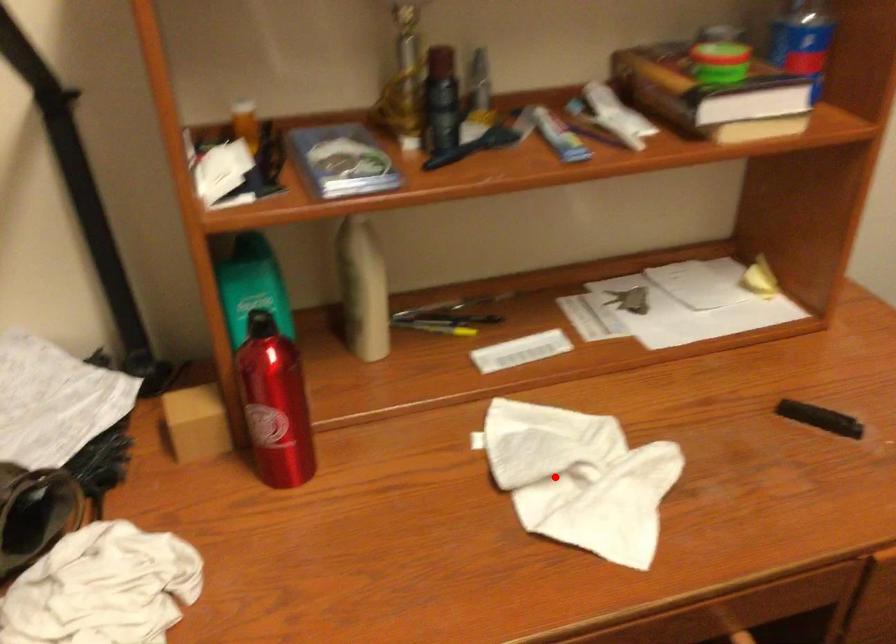
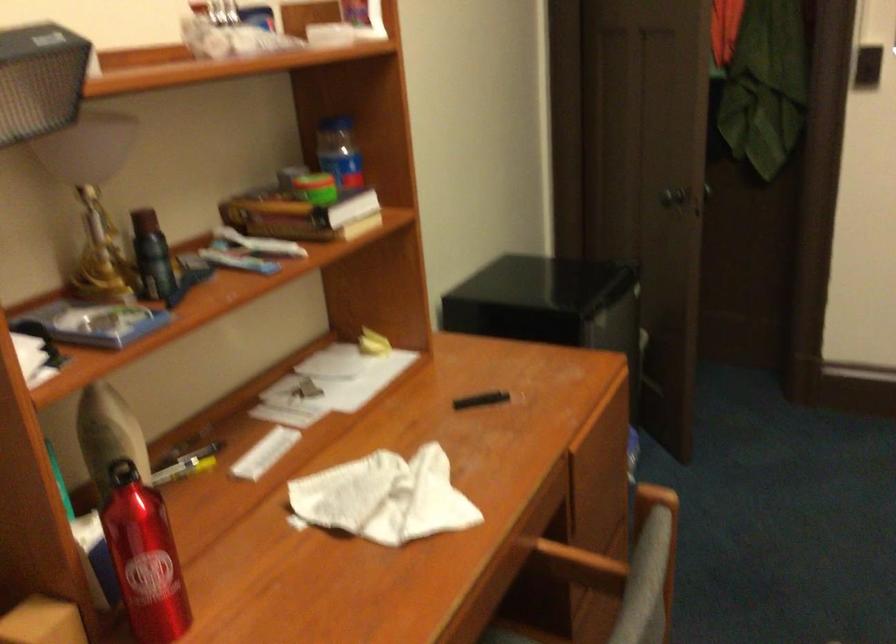
Question: I am providing you with two images of the same scene from different viewpoints. A red point is shown in image1. For the corresponding object point in image2, is it positioned nearer or farther from the camera?

Choices:
 (A) Nearer
 (B) Farther

Answer: (B)